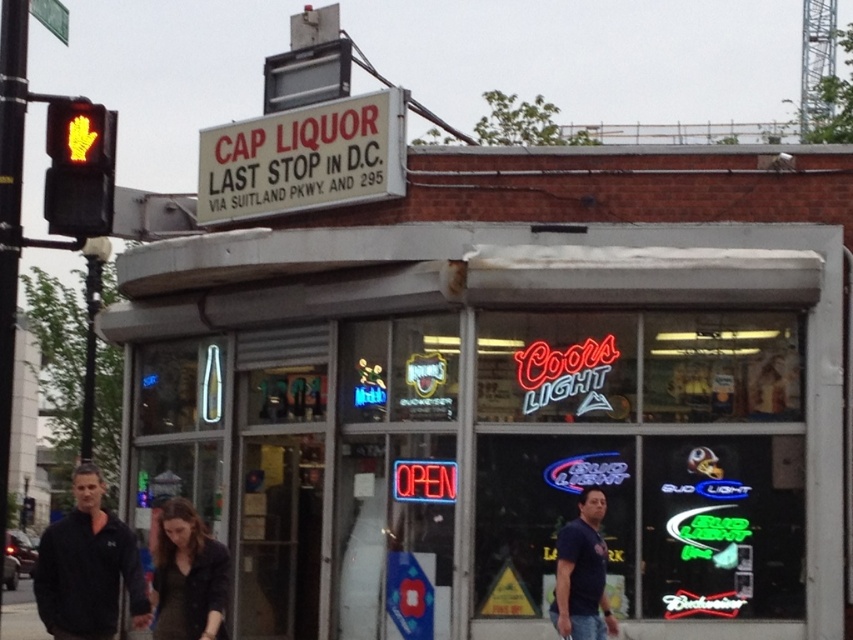
Question: Among these points, which one is farthest from the camera?

Choices:
 (A) (312, 209)
 (B) (560, 564)
 (C) (96, 561)
 (D) (666, 355)

Answer: (A)

Question: Which point is closer to the camera?

Choices:
 (A) 190,637
 (B) 99,611
 (C) 96,182
 (D) 235,467

Answer: (A)

Question: Which of the following is the closest to the observer?

Choices:
 (A) dark blue t-shirt at lower right
 (B) neon sign at center

Answer: (A)

Question: Is dark brown leather jacket at lower center bigger than dark blue t-shirt at lower right?

Choices:
 (A) no
 (B) yes

Answer: (A)

Question: Can you confirm if black fleece jacket at lower left is bigger than dark blue t-shirt at lower right?

Choices:
 (A) yes
 (B) no

Answer: (A)

Question: Is neon sign at center above white plastic sign at upper center?

Choices:
 (A) no
 (B) yes

Answer: (A)